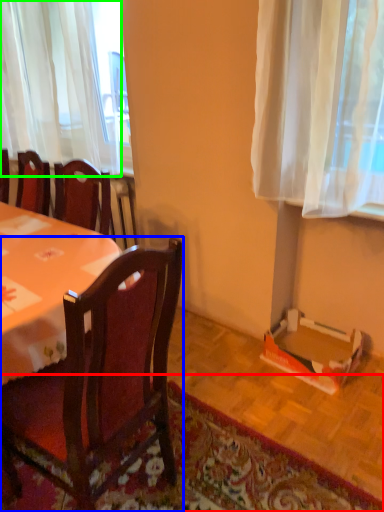
Question: Which object is the farthest from mat (highlighted by a red box)? Choose among these: chair (highlighted by a blue box) or curtain (highlighted by a green box).

Choices:
 (A) chair
 (B) curtain

Answer: (B)